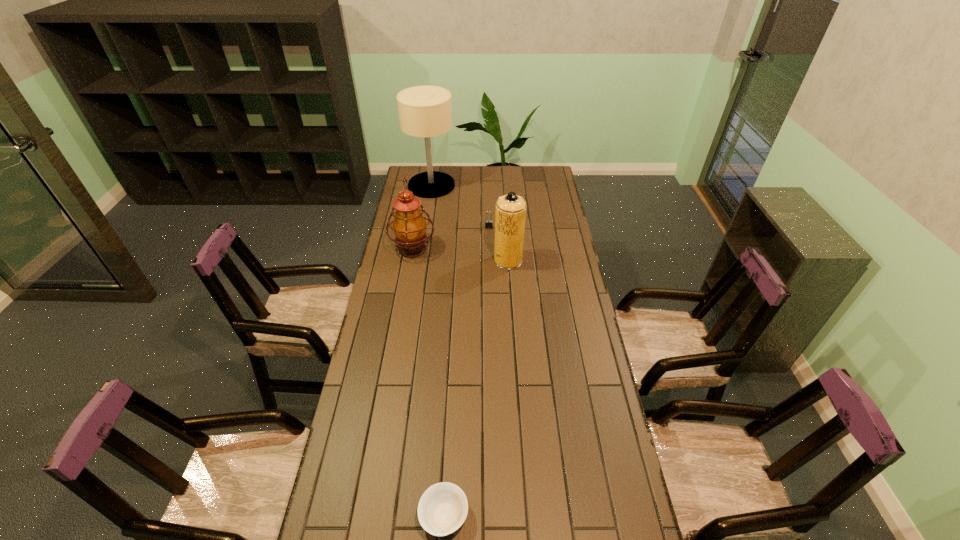
Image resolution: width=960 pixels, height=540 pixels. What are the coordinates of `the farthest object` in the screenshot? It's located at (425, 111).

The height and width of the screenshot is (540, 960). What are the coordinates of `table lamp` in the screenshot? It's located at (425, 111).

At what (x,y) coordinates should I click in order to perform the action: click on oil lamp. Please return your answer as a coordinate pair (x, y). Looking at the image, I should click on (409, 226).

Identify the location of aerosol can. (510, 213).

You are a GUI agent. You are given a task and a screenshot of the screen. Output one action in this format:
    pyautogui.click(x=<x>, y=<y>)
    Task: Click on the fourth tallest object
    The width and height of the screenshot is (960, 540).
    Given the screenshot: What is the action you would take?
    pyautogui.click(x=488, y=223)

The height and width of the screenshot is (540, 960). Identify the location of the second farthest object. (488, 223).

This screenshot has height=540, width=960. What are the coordinates of `free region located 0.300m on the right of the farthest object` in the screenshot? It's located at (512, 185).

Identify the location of vacant area situated 0.280m on the back of the oil lamp. (421, 200).

In order to click on vacant region located on the left of the aerosol can in this screenshot , I will do `click(421, 260)`.

The width and height of the screenshot is (960, 540). What are the coordinates of `vacant space situated 0.160m on the shackle of the padlock` in the screenshot? It's located at point(490,251).